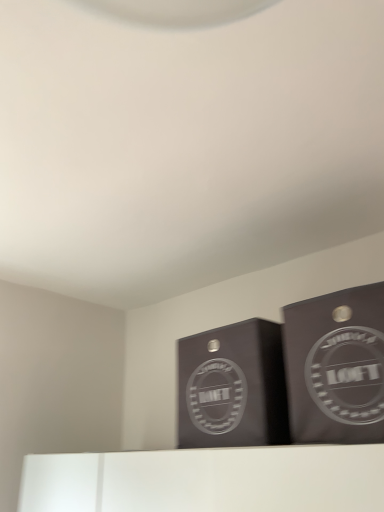
The width and height of the screenshot is (384, 512). What do you see at coordinates (336, 366) in the screenshot?
I see `matte black cardboard box at upper right, which is the 1th cardboard box in right-to-left order` at bounding box center [336, 366].

How much space does matte black cardboard box at upper right, which is the 1th cardboard box in right-to-left order, occupy horizontally?

matte black cardboard box at upper right, which is the 1th cardboard box in right-to-left order, is 14.38 inches wide.

The image size is (384, 512). What are the coordinates of `matte black cardboard box at upper right, which is the 1th cardboard box in right-to-left order` in the screenshot? It's located at (336, 366).

At what (x,y) coordinates should I click in order to perform the action: click on matte black box at center, which appears as the second cardboard box when viewed from the right. Please return your answer as a coordinate pair (x, y). Image resolution: width=384 pixels, height=512 pixels. Looking at the image, I should click on (232, 387).

What do you see at coordinates (232, 387) in the screenshot? I see `matte black box at center, which appears as the second cardboard box when viewed from the right` at bounding box center [232, 387].

Locate an element on the screen. The width and height of the screenshot is (384, 512). matte black cardboard box at upper right, the 2th cardboard box viewed from the left is located at coordinates click(336, 366).

Considering the positions of objects matte black box at center, the 1th cardboard box positioned from the left, and matte black cardboard box at upper right, the 2th cardboard box viewed from the left, in the image provided, who is more to the left, matte black box at center, the 1th cardboard box positioned from the left, or matte black cardboard box at upper right, the 2th cardboard box viewed from the left,?

matte black box at center, the 1th cardboard box positioned from the left.

Considering the positions of objects matte black box at center, which appears as the second cardboard box when viewed from the right, and matte black cardboard box at upper right, the 2th cardboard box viewed from the left, in the image provided, who is behind, matte black box at center, which appears as the second cardboard box when viewed from the right, or matte black cardboard box at upper right, the 2th cardboard box viewed from the left,?

matte black box at center, which appears as the second cardboard box when viewed from the right, is further away from the camera.

Considering the positions of point (243, 369) and point (376, 285), is point (243, 369) closer or farther from the camera than point (376, 285)?

Point (243, 369).

From the image's perspective, would you say matte black box at center, the 1th cardboard box positioned from the left, is shown under matte black cardboard box at upper right, which is the 1th cardboard box in right-to-left order?

Yes, from the image's perspective, matte black box at center, the 1th cardboard box positioned from the left, is below matte black cardboard box at upper right, which is the 1th cardboard box in right-to-left order.

From a real-world perspective, is matte black box at center, the 1th cardboard box positioned from the left, positioned under matte black cardboard box at upper right, which is the 1th cardboard box in right-to-left order, based on gravity?

No.

Is matte black box at center, which appears as the second cardboard box when viewed from the right, thinner than matte black cardboard box at upper right, the 2th cardboard box viewed from the left?

No.

Which of these two, matte black box at center, which appears as the second cardboard box when viewed from the right, or matte black cardboard box at upper right, which is the 1th cardboard box in right-to-left order, stands taller?

matte black cardboard box at upper right, which is the 1th cardboard box in right-to-left order, is taller.

Is matte black box at center, the 1th cardboard box positioned from the left, bigger than matte black cardboard box at upper right, the 2th cardboard box viewed from the left?

Yes.

Can we say matte black box at center, the 1th cardboard box positioned from the left, lies outside matte black cardboard box at upper right, the 2th cardboard box viewed from the left?

matte black box at center, the 1th cardboard box positioned from the left, lies outside matte black cardboard box at upper right, the 2th cardboard box viewed from the left,'s area.

Is matte black box at center, the 1th cardboard box positioned from the left, not near matte black cardboard box at upper right, which is the 1th cardboard box in right-to-left order?

matte black box at center, the 1th cardboard box positioned from the left, is actually quite close to matte black cardboard box at upper right, which is the 1th cardboard box in right-to-left order.

Is matte black box at center, which appears as the second cardboard box when viewed from the right, oriented towards matte black cardboard box at upper right, the 2th cardboard box viewed from the left?

No, matte black box at center, which appears as the second cardboard box when viewed from the right, is not oriented towards matte black cardboard box at upper right, the 2th cardboard box viewed from the left.

Can you tell me how much matte black box at center, the 1th cardboard box positioned from the left, and matte black cardboard box at upper right, the 2th cardboard box viewed from the left, differ in facing direction?

The angular difference between matte black box at center, the 1th cardboard box positioned from the left, and matte black cardboard box at upper right, the 2th cardboard box viewed from the left, is 0.000161 degrees.

This screenshot has width=384, height=512. In order to click on cardboard box that appears on the left of matte black cardboard box at upper right, the 2th cardboard box viewed from the left in this screenshot , I will do `click(232, 387)`.

Is matte black cardboard box at upper right, which is the 1th cardboard box in right-to-left order, to the left or to the right of matte black box at center, the 1th cardboard box positioned from the left, in the image?

In the image, matte black cardboard box at upper right, which is the 1th cardboard box in right-to-left order, appears on the right side of matte black box at center, the 1th cardboard box positioned from the left.

In the image, is matte black cardboard box at upper right, which is the 1th cardboard box in right-to-left order, positioned in front of or behind matte black box at center, which appears as the second cardboard box when viewed from the right?

matte black cardboard box at upper right, which is the 1th cardboard box in right-to-left order, is in front of matte black box at center, which appears as the second cardboard box when viewed from the right.

Which is nearer, (301, 374) or (252, 366)?

Point (301, 374) is closer to the camera than point (252, 366).

From the image's perspective, is matte black cardboard box at upper right, which is the 1th cardboard box in right-to-left order, above matte black box at center, the 1th cardboard box positioned from the left?

Yes, from the image's perspective, matte black cardboard box at upper right, which is the 1th cardboard box in right-to-left order, is above matte black box at center, the 1th cardboard box positioned from the left.

From a real-world perspective, which object stands above the other?

matte black box at center, which appears as the second cardboard box when viewed from the right, from a real-world perspective.

Which of these two, matte black cardboard box at upper right, the 2th cardboard box viewed from the left, or matte black box at center, which appears as the second cardboard box when viewed from the right, is thinner?

matte black cardboard box at upper right, the 2th cardboard box viewed from the left.

Between matte black cardboard box at upper right, which is the 1th cardboard box in right-to-left order, and matte black box at center, which appears as the second cardboard box when viewed from the right, which one has less height?

With less height is matte black box at center, which appears as the second cardboard box when viewed from the right.

Consider the image. Can you confirm if matte black cardboard box at upper right, which is the 1th cardboard box in right-to-left order, is bigger than matte black box at center, the 1th cardboard box positioned from the left?

No.

Is matte black cardboard box at upper right, which is the 1th cardboard box in right-to-left order, completely or partially outside of matte black box at center, the 1th cardboard box positioned from the left?

Yes.

Is matte black cardboard box at upper right, which is the 1th cardboard box in right-to-left order, far away from matte black box at center, which appears as the second cardboard box when viewed from the right?

No, matte black cardboard box at upper right, which is the 1th cardboard box in right-to-left order, is not far from matte black box at center, which appears as the second cardboard box when viewed from the right.

Is matte black box at center, which appears as the second cardboard box when viewed from the right, at the back of matte black cardboard box at upper right, the 2th cardboard box viewed from the left?

matte black cardboard box at upper right, the 2th cardboard box viewed from the left, is not turned away from matte black box at center, which appears as the second cardboard box when viewed from the right.

How many degrees apart are the facing directions of matte black cardboard box at upper right, which is the 1th cardboard box in right-to-left order, and matte black box at center, the 1th cardboard box positioned from the left?

The angle between the facing direction of matte black cardboard box at upper right, which is the 1th cardboard box in right-to-left order, and the facing direction of matte black box at center, the 1th cardboard box positioned from the left, is 0.000161 degrees.

In the image, there is a matte black box at center, the 1th cardboard box positioned from the left. Where is `cardboard box above it (from the image's perspective)`? The width and height of the screenshot is (384, 512). cardboard box above it (from the image's perspective) is located at coordinates (336, 366).

At what (x,y) coordinates should I click in order to perform the action: click on cardboard box below the matte black cardboard box at upper right, which is the 1th cardboard box in right-to-left order (from the image's perspective). Please return your answer as a coordinate pair (x, y). This screenshot has height=512, width=384. Looking at the image, I should click on (232, 387).

What are the coordinates of `cardboard box above the matte black cardboard box at upper right, the 2th cardboard box viewed from the left (from a real-world perspective)` in the screenshot? It's located at (232, 387).